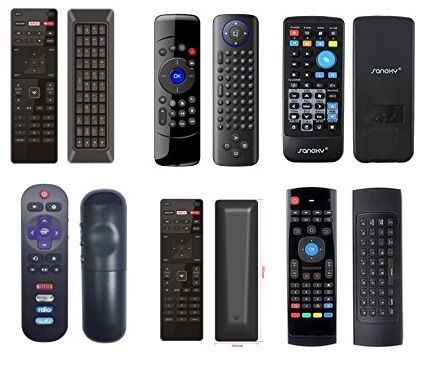
Identify the location of power button on remote controls. (294, 202), (196, 211), (40, 191), (294, 36), (190, 54), (48, 24).